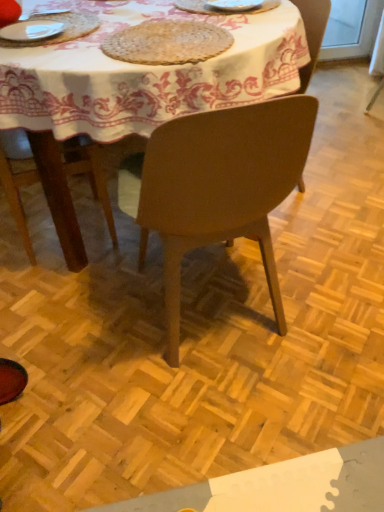
I want to click on vacant space in between matte brown chair at center, which ranks as the 1th chair in back-to-front order, and white fabric tablecloth at center, so click(x=314, y=218).